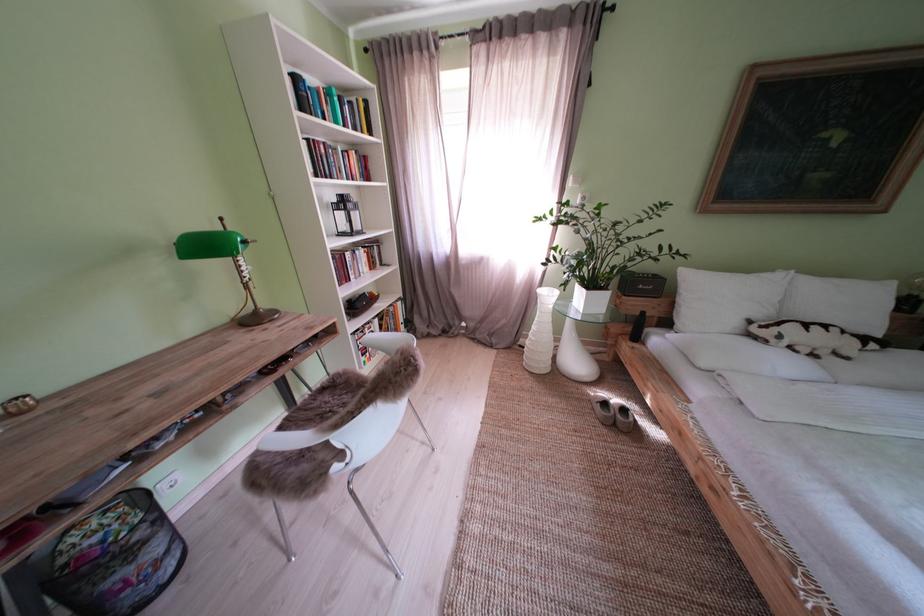
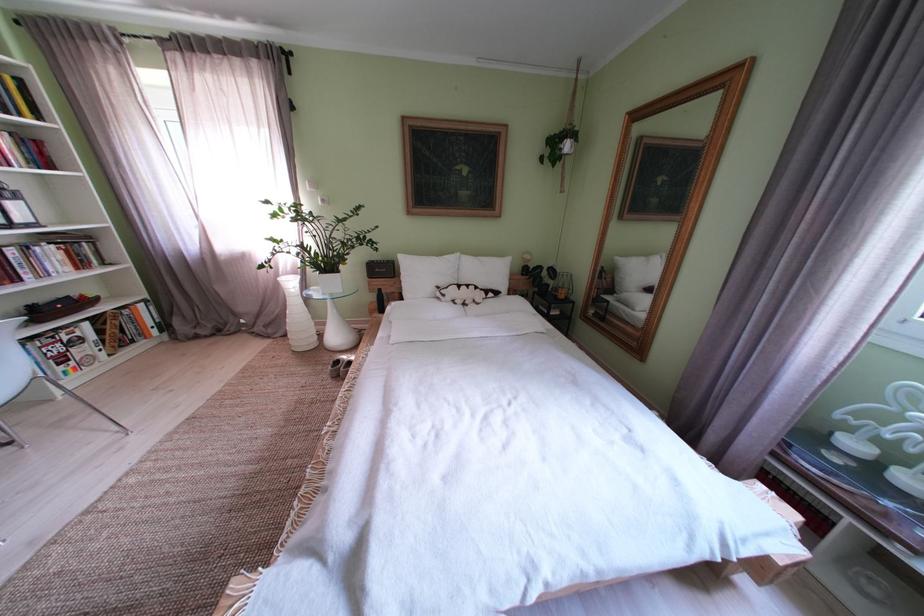
The point at (600,294) is marked in the first image. Where is the corresponding point in the second image?

(333, 278)